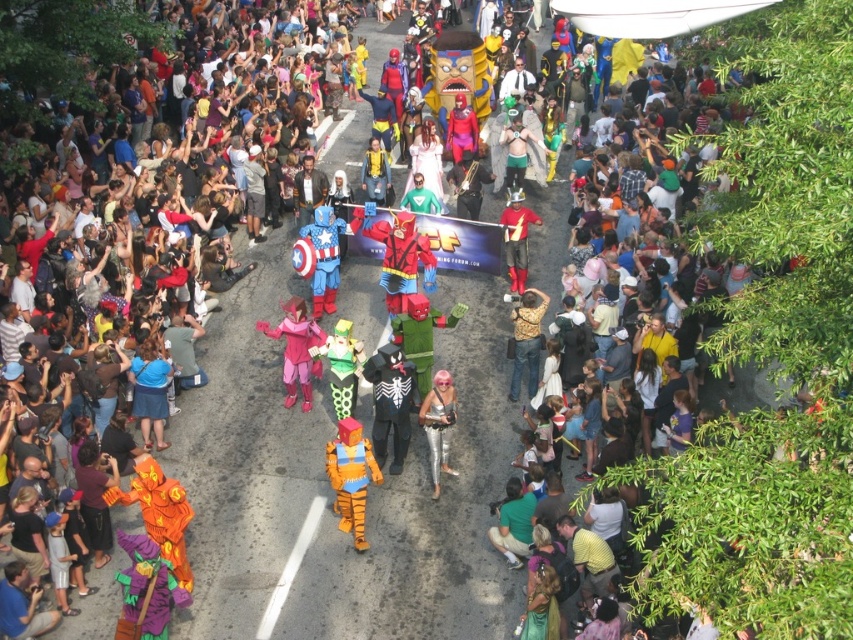
You are a photographer at the parade. You want to take a photo of both the blue matte captain america costume at center and the shiny metallic costume at center. Which costume should you focus on first to ensure both are in frame?

The blue matte captain america costume at center is taller than the shiny metallic costume at center. Focus on the taller costume first to ensure it fits within the frame, then adjust to include the shorter one.

You are a photographer at the parade. You want to capture a photo that includes both the silver metallic jumpsuit at center and the gold metallic jacket at center. Based on their positions, which one is positioned lower in the frame?

The silver metallic jumpsuit at center is located below the gold metallic jacket at center, so it is positioned lower in the frame.

You are a parade attendee standing on the sidewalk. You see the orange fabric tiger at center and the silver metallic jumpsuit at center. Which one is closer to your left side?

The orange fabric tiger at center is to the left of the silver metallic jumpsuit at center, so the orange fabric tiger at center is closer to your left side.